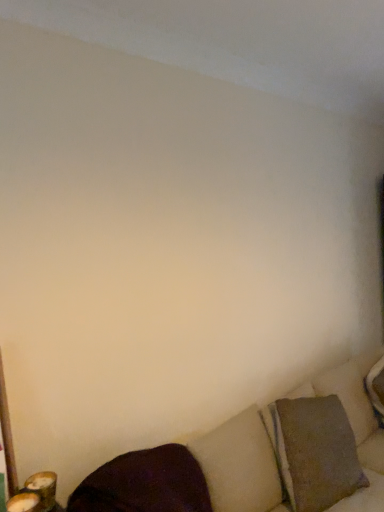
Measure the distance between dark matte pillow at lower left, marked as the 1th pillow in a left-to-right arrangement, and camera.

They are 4.17 feet apart.

Locate an element on the screen. The width and height of the screenshot is (384, 512). dark matte pillow at lower left, which is the 1th pillow in front-to-back order is located at coordinates (145, 483).

Image resolution: width=384 pixels, height=512 pixels. In order to click on textured beige couch at lower right in this screenshot , I will do `click(260, 459)`.

How different are the orientations of dark matte pillow at lower left, which ranks as the second pillow in back-to-front order, and textured brown pillow at lower right, positioned as the second pillow in left-to-right order, in degrees?

There is a 0.191-degree angle between the facing directions of dark matte pillow at lower left, which ranks as the second pillow in back-to-front order, and textured brown pillow at lower right, positioned as the second pillow in left-to-right order.

Locate an element on the screen. pillow that is under the dark matte pillow at lower left, marked as the 1th pillow in a left-to-right arrangement (from a real-world perspective) is located at coordinates (315, 452).

Between dark matte pillow at lower left, arranged as the second pillow when viewed from the right, and textured brown pillow at lower right, positioned as the second pillow in left-to-right order, which one appears on the left side from the viewer's perspective?

dark matte pillow at lower left, arranged as the second pillow when viewed from the right, is more to the left.

Which object is closer to the camera taking this photo, dark matte pillow at lower left, arranged as the second pillow when viewed from the right, or textured brown pillow at lower right, arranged as the first pillow when viewed from the right?

dark matte pillow at lower left, arranged as the second pillow when viewed from the right.

Could you measure the distance between dark matte pillow at lower left, marked as the 1th pillow in a left-to-right arrangement, and textured beige couch at lower right?

They are 7.90 inches apart.

Which is correct: dark matte pillow at lower left, which is the 1th pillow in front-to-back order, is inside textured beige couch at lower right, or outside of it?

dark matte pillow at lower left, which is the 1th pillow in front-to-back order, can be found inside textured beige couch at lower right.

Is dark matte pillow at lower left, which is the 1th pillow in front-to-back order, to the left or to the right of textured beige couch at lower right in the image?

Based on their positions, dark matte pillow at lower left, which is the 1th pillow in front-to-back order, is located to the left of textured beige couch at lower right.

Is dark matte pillow at lower left, arranged as the second pillow when viewed from the right, looking in the opposite direction of textured beige couch at lower right?

Yes, dark matte pillow at lower left, arranged as the second pillow when viewed from the right, is positioned with its back facing textured beige couch at lower right.

Can you confirm if textured brown pillow at lower right, the second pillow in the front-to-back sequence, is positioned to the left of textured beige couch at lower right?

No.

From the image's perspective, is textured brown pillow at lower right, positioned as the second pillow in left-to-right order, on top of textured beige couch at lower right?

Yes, from the image's perspective, textured brown pillow at lower right, positioned as the second pillow in left-to-right order, is on top of textured beige couch at lower right.

From a real-world perspective, is textured brown pillow at lower right, positioned as the second pillow in left-to-right order, positioned under textured beige couch at lower right based on gravity?

Answer: Yes.

Relative to dark matte pillow at lower left, which ranks as the second pillow in back-to-front order, is textured beige couch at lower right in front or behind?

Visually, textured beige couch at lower right is located in front of dark matte pillow at lower left, which ranks as the second pillow in back-to-front order.

Is dark matte pillow at lower left, marked as the 1th pillow in a left-to-right arrangement, a part of textured beige couch at lower right?

Yes, dark matte pillow at lower left, marked as the 1th pillow in a left-to-right arrangement, is a part of textured beige couch at lower right.

What are the coordinates of `studio couch below the dark matte pillow at lower left, which ranks as the second pillow in back-to-front order (from the image's perspective)` in the screenshot? It's located at (260, 459).

Are textured beige couch at lower right and dark matte pillow at lower left, marked as the 1th pillow in a left-to-right arrangement, far apart?

No, textured beige couch at lower right is in close proximity to dark matte pillow at lower left, marked as the 1th pillow in a left-to-right arrangement.

Considering the relative sizes of textured beige couch at lower right and textured brown pillow at lower right, the second pillow in the front-to-back sequence, in the image provided, is textured beige couch at lower right thinner than textured brown pillow at lower right, the second pillow in the front-to-back sequence,?

Incorrect, the width of textured beige couch at lower right is not less than that of textured brown pillow at lower right, the second pillow in the front-to-back sequence.

Considering the relative positions of textured beige couch at lower right and textured brown pillow at lower right, positioned as the second pillow in left-to-right order, in the image provided, is textured beige couch at lower right to the right of textured brown pillow at lower right, positioned as the second pillow in left-to-right order, from the viewer's perspective?

In fact, textured beige couch at lower right is to the left of textured brown pillow at lower right, positioned as the second pillow in left-to-right order.

Looking at this image, considering the sizes of objects textured beige couch at lower right and textured brown pillow at lower right, arranged as the first pillow when viewed from the right, in the image provided, who is smaller, textured beige couch at lower right or textured brown pillow at lower right, arranged as the first pillow when viewed from the right,?

Smaller between the two is textured brown pillow at lower right, arranged as the first pillow when viewed from the right.

Between textured beige couch at lower right and textured brown pillow at lower right, positioned as the second pillow in left-to-right order, which one is positioned in front?

textured beige couch at lower right is in front.

From a real-world perspective, is textured brown pillow at lower right, which is counted as the first pillow, starting from the back, located beneath dark matte pillow at lower left, arranged as the second pillow when viewed from the right?

Yes.

Is textured brown pillow at lower right, arranged as the first pillow when viewed from the right, facing away from dark matte pillow at lower left, arranged as the second pillow when viewed from the right?

→ That's not correct — textured brown pillow at lower right, arranged as the first pillow when viewed from the right, is not looking away from dark matte pillow at lower left, arranged as the second pillow when viewed from the right.

This screenshot has height=512, width=384. Identify the location of pillow above the textured brown pillow at lower right, positioned as the second pillow in left-to-right order (from a real-world perspective). (145, 483).

Identify the location of pillow that is the 1st one when counting backward from the textured beige couch at lower right. (145, 483).

Based on their spatial positions, is dark matte pillow at lower left, which is the 1th pillow in front-to-back order, or textured beige couch at lower right closer to textured brown pillow at lower right, positioned as the second pillow in left-to-right order?

Based on the image, textured beige couch at lower right appears to be nearer to textured brown pillow at lower right, positioned as the second pillow in left-to-right order.

Which object lies nearer to the anchor point dark matte pillow at lower left, which ranks as the second pillow in back-to-front order, textured beige couch at lower right or textured brown pillow at lower right, which is counted as the first pillow, starting from the back?

The object closer to dark matte pillow at lower left, which ranks as the second pillow in back-to-front order, is textured beige couch at lower right.

Estimate the real-world distances between objects in this image. Which object is closer to dark matte pillow at lower left, arranged as the second pillow when viewed from the right, textured brown pillow at lower right, which is counted as the first pillow, starting from the back, or textured beige couch at lower right?

textured beige couch at lower right is positioned closer to the anchor dark matte pillow at lower left, arranged as the second pillow when viewed from the right.

Estimate the real-world distances between objects in this image. Which object is further from textured beige couch at lower right, textured brown pillow at lower right, the second pillow in the front-to-back sequence, or dark matte pillow at lower left, arranged as the second pillow when viewed from the right?

dark matte pillow at lower left, arranged as the second pillow when viewed from the right, is positioned further to the anchor textured beige couch at lower right.

Looking at the image, which one is located closer to textured beige couch at lower right, dark matte pillow at lower left, which ranks as the second pillow in back-to-front order, or textured brown pillow at lower right, positioned as the second pillow in left-to-right order?

textured brown pillow at lower right, positioned as the second pillow in left-to-right order, lies closer to textured beige couch at lower right than the other object.

Which object lies further to the anchor point textured brown pillow at lower right, which is counted as the first pillow, starting from the back, textured beige couch at lower right or dark matte pillow at lower left, marked as the 1th pillow in a left-to-right arrangement?

dark matte pillow at lower left, marked as the 1th pillow in a left-to-right arrangement, is positioned further to the anchor textured brown pillow at lower right, which is counted as the first pillow, starting from the back.

At what (x,y) coordinates should I click in order to perform the action: click on studio couch between dark matte pillow at lower left, which is the 1th pillow in front-to-back order, and textured brown pillow at lower right, the second pillow in the front-to-back sequence. Please return your answer as a coordinate pair (x, y). This screenshot has height=512, width=384. Looking at the image, I should click on (260, 459).